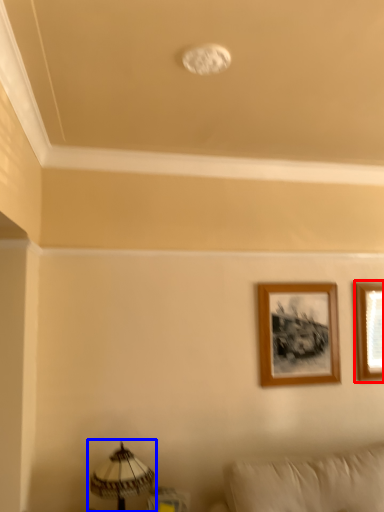
Question: Which object is further to the camera taking this photo, picture frame (highlighted by a red box) or table lamp (highlighted by a blue box)?

Choices:
 (A) picture frame
 (B) table lamp

Answer: (A)